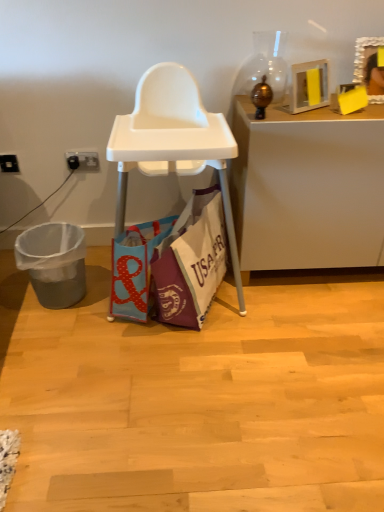
Where is `vacant space that is in between white plastic high chair at center and white glossy desk at upper right`? vacant space that is in between white plastic high chair at center and white glossy desk at upper right is located at coordinates coord(307,301).